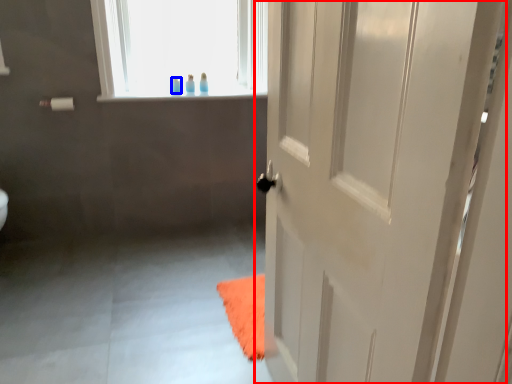
Question: Among these objects, which one is nearest to the camera, door (highlighted by a red box) or toiletry (highlighted by a blue box)?

Choices:
 (A) door
 (B) toiletry

Answer: (A)